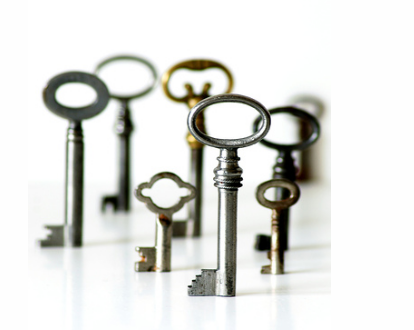
Locate an element on the screen. This screenshot has width=414, height=330. keys is located at coordinates (313, 98), (291, 111), (274, 186), (234, 141), (197, 63), (166, 177), (120, 99), (82, 108).